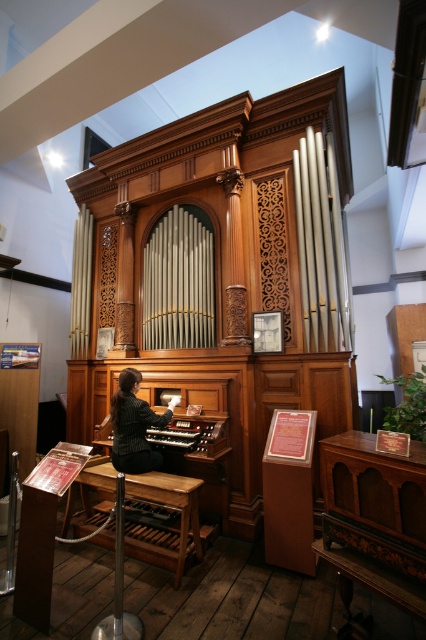
Can you confirm if black striped blazer at center is positioned above wooden organ at center?

Yes, black striped blazer at center is above wooden organ at center.

Is black striped blazer at center bigger than wooden organ at center?

Correct, black striped blazer at center is larger in size than wooden organ at center.

The height and width of the screenshot is (640, 426). I want to click on black striped blazer at center, so click(x=134, y=426).